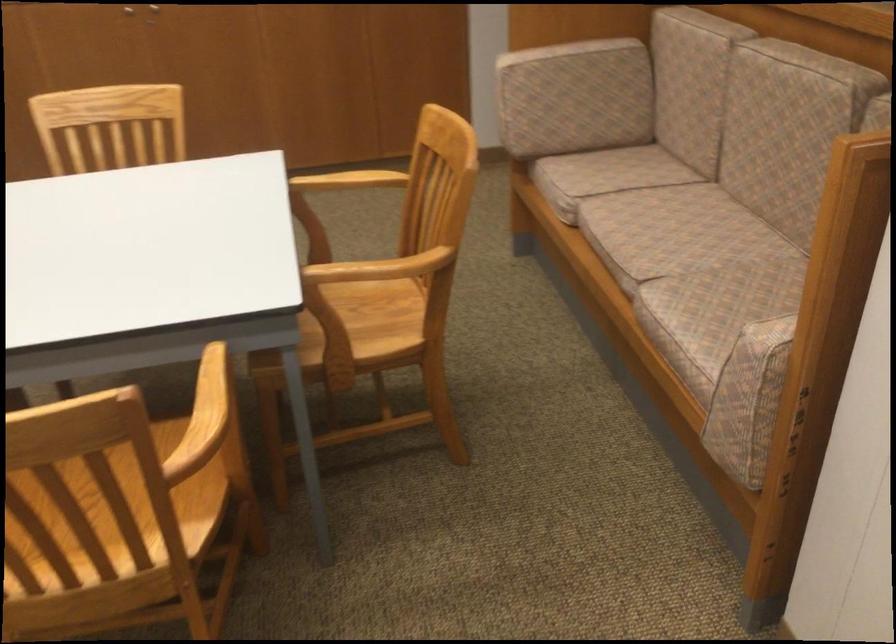
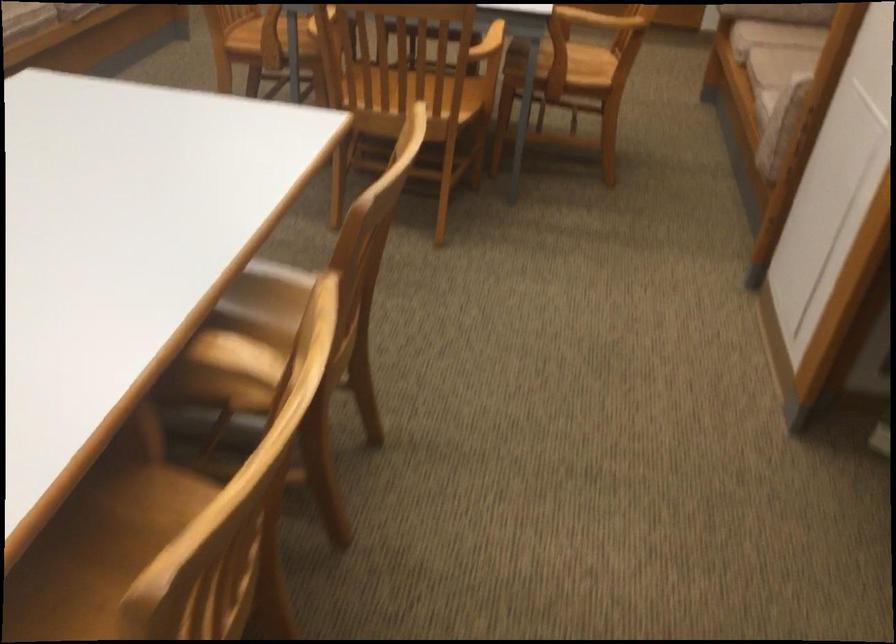
Where in the second image is the point corresponding to (x=222, y=430) from the first image?

(488, 43)